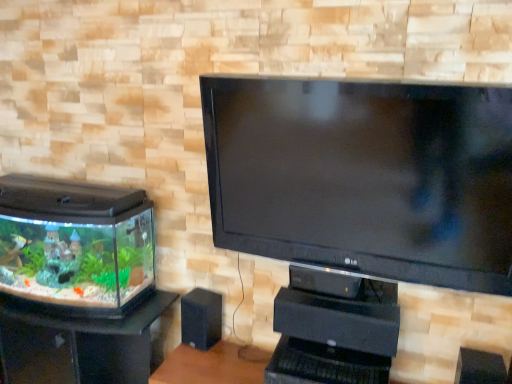
This screenshot has width=512, height=384. Describe the element at coordinates (79, 346) in the screenshot. I see `clear glass aquarium at left` at that location.

At what (x,y) coordinates should I click in order to perform the action: click on clear glass aquarium at left. Please return your answer as a coordinate pair (x, y). The height and width of the screenshot is (384, 512). Looking at the image, I should click on (79, 346).

In order to face black matte speaker at lower center, should I rotate leftwards or rightwards?

You should look left and rotate roughly 7.264 degrees.

This screenshot has width=512, height=384. What do you see at coordinates (201, 318) in the screenshot? I see `black matte speaker at lower center` at bounding box center [201, 318].

Locate an element on the screen. black matte speaker at lower center is located at coordinates (201, 318).

Locate an element on the screen. This screenshot has width=512, height=384. clear glass aquarium at left is located at coordinates [79, 346].

Which object is positioned more to the right, black matte speaker at lower center or clear glass aquarium at left?

Positioned to the right is black matte speaker at lower center.

Does black matte speaker at lower center come in front of clear glass aquarium at left?

No, black matte speaker at lower center is further to the viewer.

Considering the points (204, 330) and (108, 322), which point is behind, point (204, 330) or point (108, 322)?

Point (204, 330)

From the image's perspective, is black matte speaker at lower center located above clear glass aquarium at left?

Indeed, from the image's perspective, black matte speaker at lower center is shown above clear glass aquarium at left.

From a real-world perspective, is black matte speaker at lower center located beneath clear glass aquarium at left?

No, from a real-world perspective, black matte speaker at lower center is not beneath clear glass aquarium at left.

Which of these two, black matte speaker at lower center or clear glass aquarium at left, is thinner?

With smaller width is black matte speaker at lower center.

Between black matte speaker at lower center and clear glass aquarium at left, which one has more height?

Standing taller between the two is clear glass aquarium at left.

Can you confirm if black matte speaker at lower center is bigger than clear glass aquarium at left?

No, black matte speaker at lower center is not bigger than clear glass aquarium at left.

Can clear glass aquarium at left be found inside black matte speaker at lower center?

No, clear glass aquarium at left is not surrounded by black matte speaker at lower center.

Is black matte speaker at lower center placed right next to clear glass aquarium at left?

No, black matte speaker at lower center is not beside clear glass aquarium at left.

Does black matte speaker at lower center turn towards clear glass aquarium at left?

No, black matte speaker at lower center is not aimed at clear glass aquarium at left.

What's the angular difference between black matte speaker at lower center and clear glass aquarium at left's facing directions?

10.4 degrees separate the facing orientations of black matte speaker at lower center and clear glass aquarium at left.

How much distance is there between black matte speaker at lower center and clear glass aquarium at left?

They are 14.85 inches apart.

This screenshot has height=384, width=512. In order to click on speaker located above the clear glass aquarium at left (from the image's perspective) in this screenshot , I will do `click(201, 318)`.

Considering the positions of objects clear glass aquarium at left and black matte speaker at lower center in the image provided, who is more to the left, clear glass aquarium at left or black matte speaker at lower center?

clear glass aquarium at left is more to the left.

Is clear glass aquarium at left closer to camera compared to black matte speaker at lower center?

That is True.

Is point (20, 376) more distant than point (212, 298)?

No, it is in front of (212, 298).

From the image's perspective, is clear glass aquarium at left on top of black matte speaker at lower center?

No, from the image's perspective, clear glass aquarium at left is not over black matte speaker at lower center.

From a real-world perspective, who is located higher, clear glass aquarium at left or black matte speaker at lower center?

black matte speaker at lower center.

Does clear glass aquarium at left have a greater width compared to black matte speaker at lower center?

Yes.

Does clear glass aquarium at left have a lesser height compared to black matte speaker at lower center?

Incorrect, the height of clear glass aquarium at left does not fall short of that of black matte speaker at lower center.

Considering the relative sizes of clear glass aquarium at left and black matte speaker at lower center in the image provided, is clear glass aquarium at left smaller than black matte speaker at lower center?

Incorrect, clear glass aquarium at left is not smaller in size than black matte speaker at lower center.

Is black matte speaker at lower center located within clear glass aquarium at left?

No, black matte speaker at lower center is not inside clear glass aquarium at left.

Is clear glass aquarium at left next to black matte speaker at lower center and touching it?

No, clear glass aquarium at left is not in contact with black matte speaker at lower center.

Could you tell me if clear glass aquarium at left is turned towards black matte speaker at lower center?

No, clear glass aquarium at left does not turn towards black matte speaker at lower center.

You are a GUI agent. You are given a task and a screenshot of the screen. Output one action in this format:
    pyautogui.click(x=<x>, y=<y>)
    Task: Click on the furniture in front of the black matte speaker at lower center
    
    Given the screenshot: What is the action you would take?
    pyautogui.click(x=79, y=346)

Locate an element on the screen. This screenshot has height=384, width=512. speaker to the right of clear glass aquarium at left is located at coordinates (201, 318).

At what (x,y) coordinates should I click in order to perform the action: click on furniture in front of the black matte speaker at lower center. Please return your answer as a coordinate pair (x, y). Looking at the image, I should click on (79, 346).